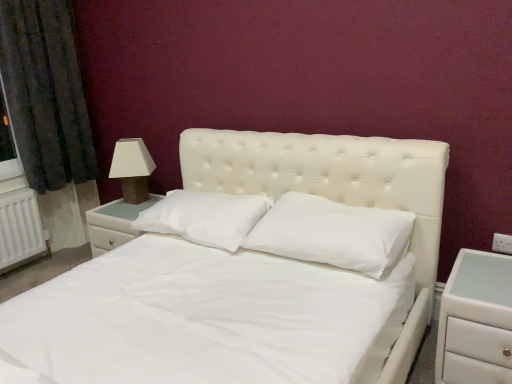
Question: From a real-world perspective, relative to white glossy nightstand at left, which appears as the 2th nightstand when viewed from the right, is white matte nightstand at right, the 2th nightstand from the left, vertically above or below?

Choices:
 (A) above
 (B) below

Answer: (B)

Question: Is white matte nightstand at right, the first nightstand in the front-to-back sequence, to the left or to the right of white glossy nightstand at left, the first nightstand when ordered from back to front, in the image?

Choices:
 (A) right
 (B) left

Answer: (A)

Question: Which object is the farthest from the white glossy nightstand at left, which appears as the 2th nightstand when viewed from the right?

Choices:
 (A) matte white lampshade at left
 (B) white matte nightstand at right, the 2th nightstand from the left
 (C) white soft pillow at center, the second pillow positioned from the right
 (D) white soft pillow at center, the 2th pillow when ordered from left to right

Answer: (B)

Question: Which of these objects is positioned closest to the white matte nightstand at right, placed as the first nightstand when sorted from right to left?

Choices:
 (A) white soft pillow at center, marked as the first pillow in a right-to-left arrangement
 (B) white glossy nightstand at left, placed as the first nightstand when sorted from left to right
 (C) matte white lampshade at left
 (D) white soft pillow at center, the second pillow positioned from the right

Answer: (A)